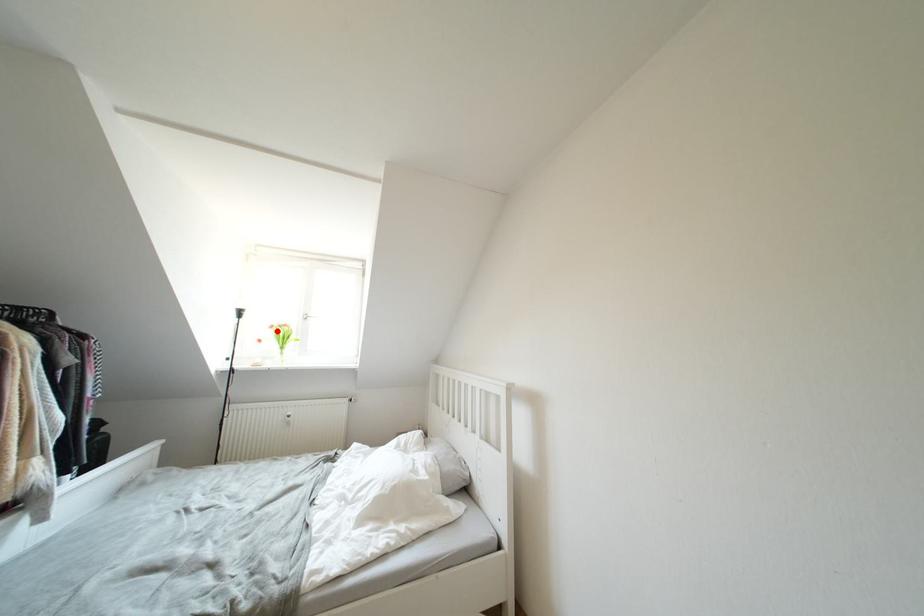
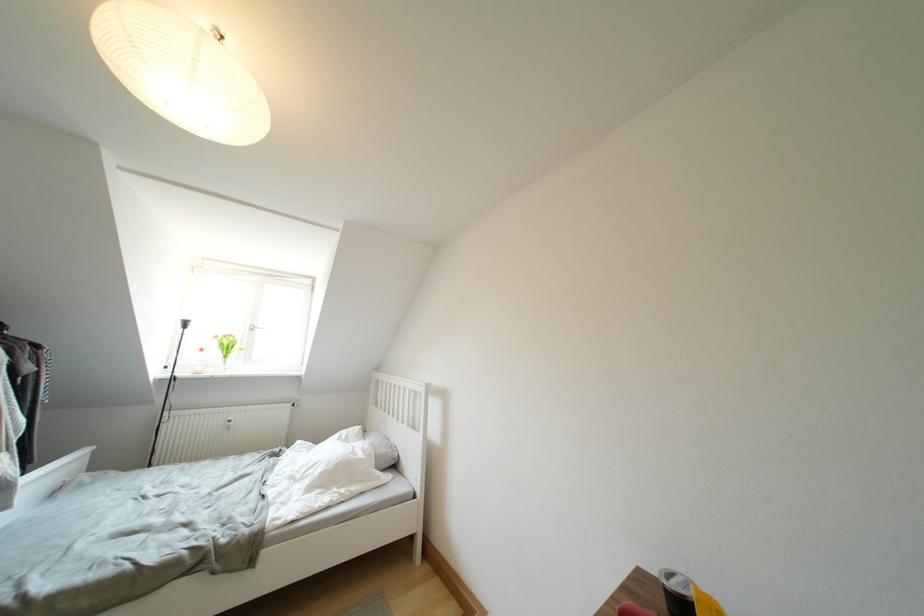
Where in the second image is the point corresponding to the highlighted location from the first image?

(222, 341)